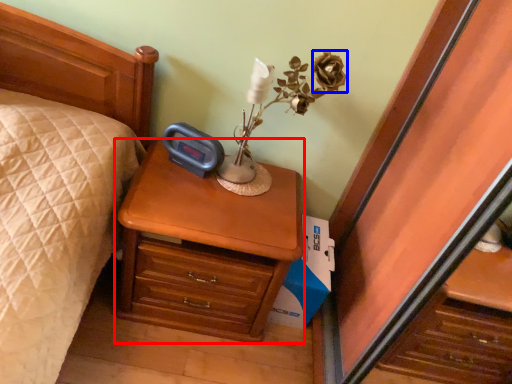
Question: Which point is closer to the camera, nightstand (highlighted by a red box) or flower (highlighted by a blue box)?

Choices:
 (A) nightstand
 (B) flower

Answer: (A)